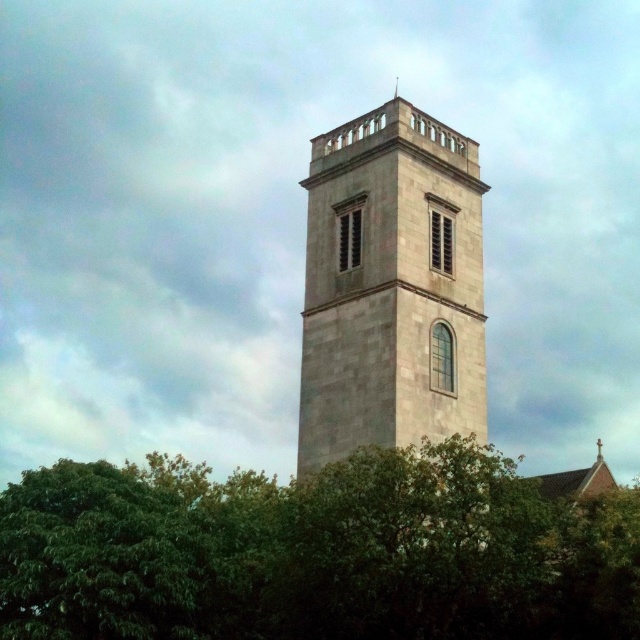
Does green leafy tree at center have a lesser width compared to light gray stone tower at center?

Incorrect, green leafy tree at center's width is not less than light gray stone tower at center's.

Is green leafy tree at center smaller than light gray stone tower at center?

Incorrect, green leafy tree at center is not smaller in size than light gray stone tower at center.

Who is more distant from viewer, (518, 545) or (348, 308)?

Positioned behind is point (348, 308).

You are a GUI agent. You are given a task and a screenshot of the screen. Output one action in this format:
    pyautogui.click(x=<x>, y=<y>)
    Task: Click on the green leafy tree at center
    
    Given the screenshot: What is the action you would take?
    pyautogui.click(x=316, y=552)